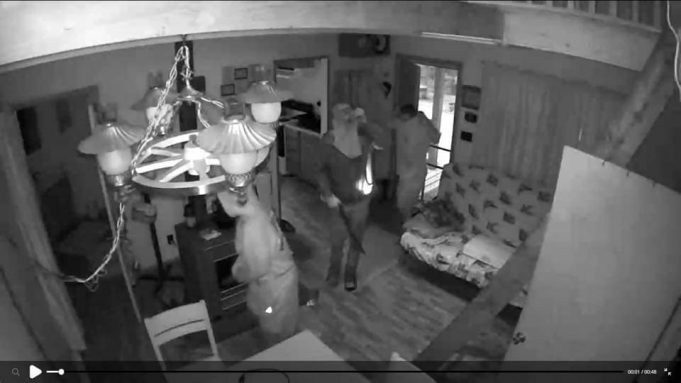
Locate an element on the screen. couch is located at coordinates (498, 205).